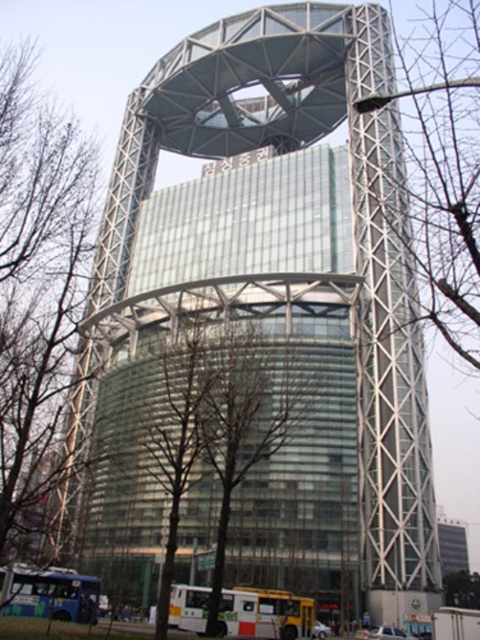
You are standing in front of the cylindrical building with the glass facade. You notice two trees in the scene. Which tree, the bare branches at center or the green leafy tree at center, is closer to you?

The bare branches at center is closer to you because it is in front of the green leafy tree at center.

You are standing in front of the modern architectural structure. Where exactly are the bare branches at center located in the image?

The bare branches at center are located at point coordinates of 0.664 on the x axis and 0.510 on the y axis.